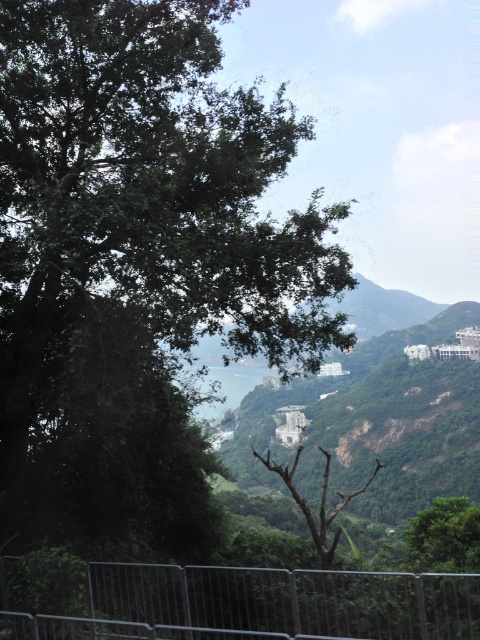
You are a photographer setting up a tripod to capture the green leafy tree at upper left and the metallic silver fence at lower center in the same frame. Based on their heights, which object will appear larger in the photo?

The green leafy tree at upper left will appear larger in the photo because it is taller than the metallic silver fence at lower center.

You are a landscape architect designing a walking path between the green leafy tree at upper left and the metallic silver fence at lower center. The path must be at least 14 meters long to accommodate safety features. Can the path be designed as planned?

The distance between the green leafy tree at upper left and the metallic silver fence at lower center is 13.98 meters, which is slightly shorter than the required 14 meters. Therefore, the path cannot be designed as planned without adjusting the route to meet the minimum length requirement.

Consider the image. You are standing at the point marked as point (136, 260) in the image. What object is located exactly at that point?

The green leafy tree at upper left is located exactly at point (136, 260).